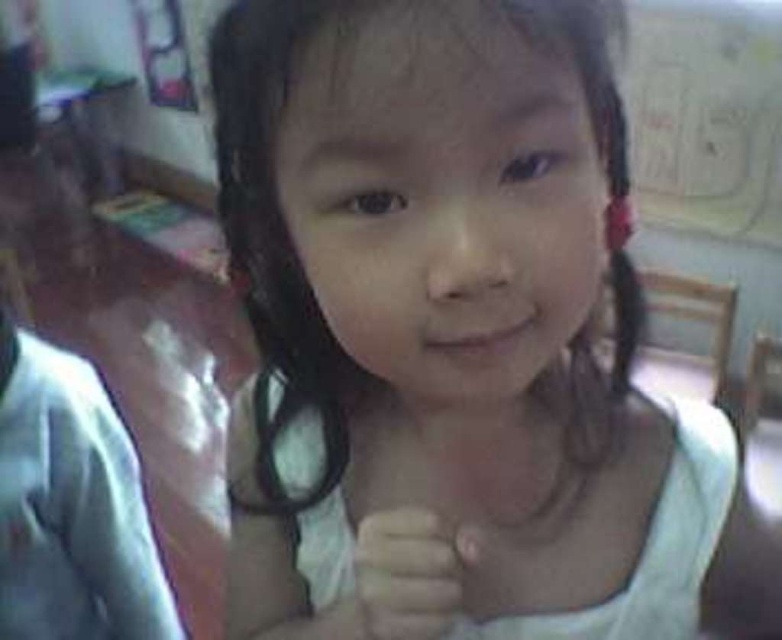
You are a photographer setting up a shoot in this room. You need to position a light source so that it illuminates the white fabric dress at center and the white matte hand at center equally. Based on their positions, which object should be placed closer to the light source to achieve even illumination?

The white fabric dress at center is to the right of the white matte hand at center, so to achieve even illumination, the white matte hand at center should be moved closer to the light source since it is farther away.

You are standing in the room and want to reach both the point at coordinates point (375, 147) and the point at coordinates point (389, 611). Which point will you reach first?

You will reach the point at coordinates point (375, 147) first because it is closer to you than the point at coordinates point (389, 611).